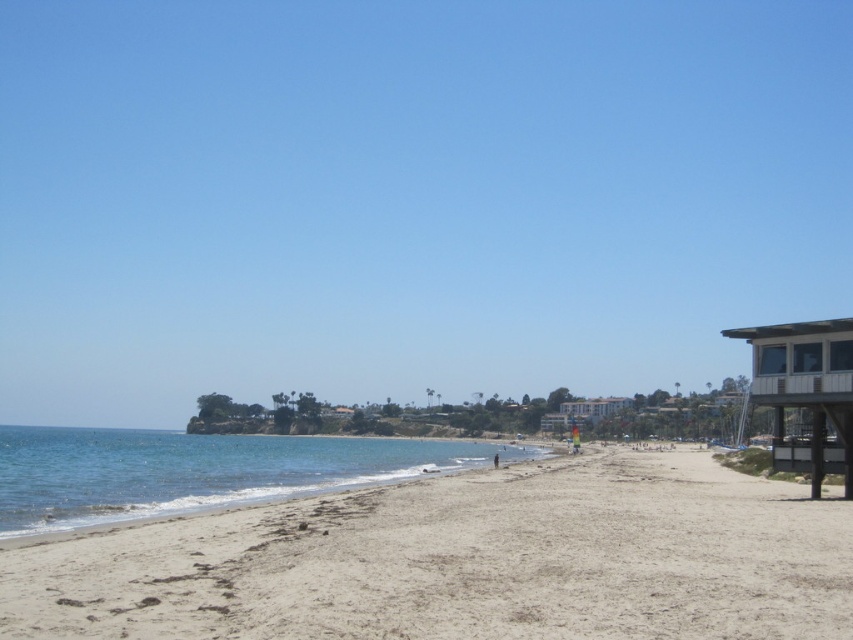
You are standing on the beach and want to walk towards the clear blue water at lower left. Which direction should you move relative to the light beige sand at lower center?

You should move towards the lower left direction relative to the light beige sand at lower center because the clear blue water at lower left is located in that direction.

You are standing on the beach and want to walk towards the clear blue water at lower left. Which direction should you move relative to the light beige sand at lower center?

You should move away from the light beige sand at lower center because the clear blue water at lower left is further away from the viewer than the light beige sand at lower center.